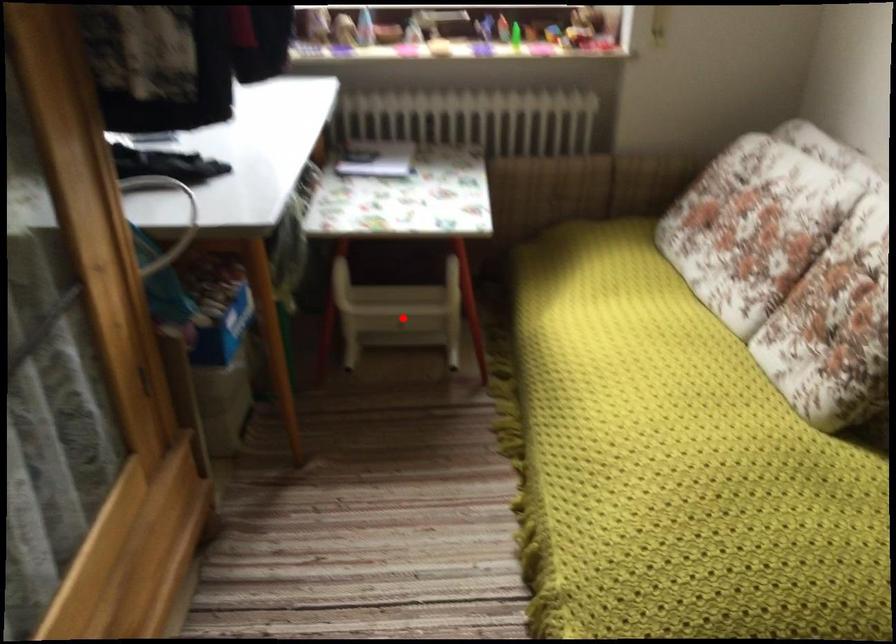
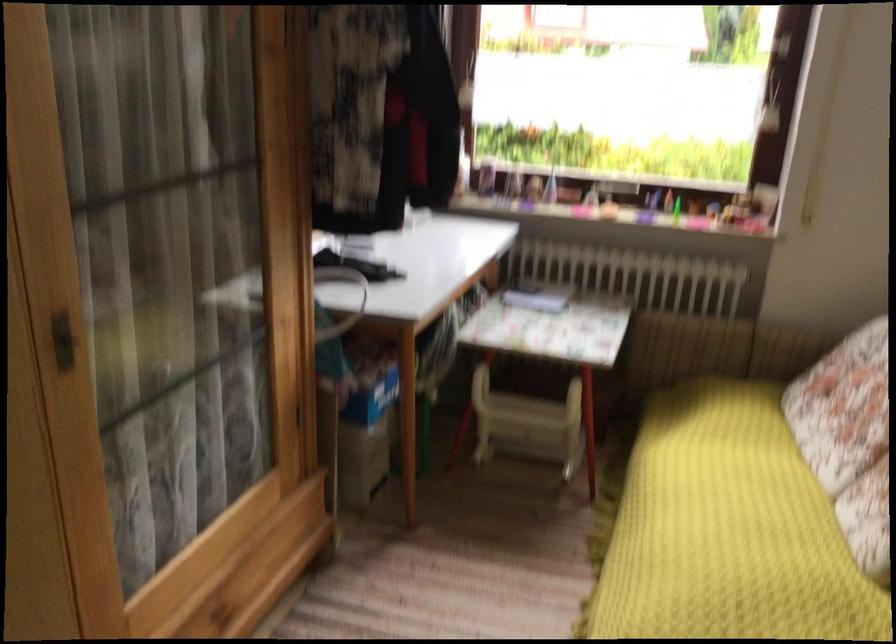
Where in the second image is the point corresponding to the highlighted location from the first image?

(528, 424)